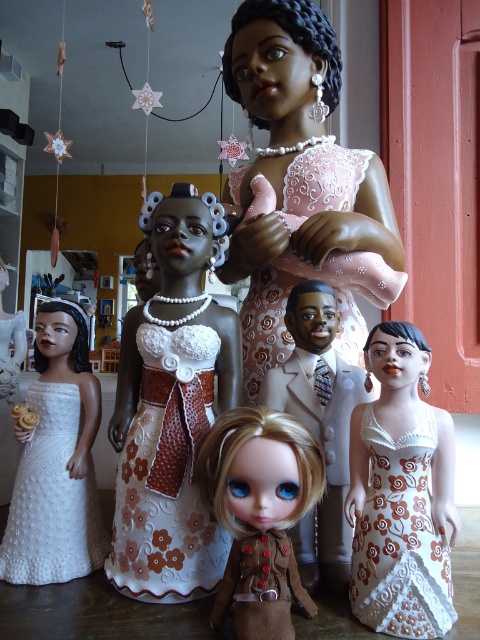
Can you confirm if pink lace dress at center is positioned below white textured dress at center?

No.

Can you confirm if pink lace dress at center is wider than white textured dress at center?

Yes, pink lace dress at center is wider than white textured dress at center.

The height and width of the screenshot is (640, 480). I want to click on pink lace dress at center, so click(x=296, y=172).

Is point (264, 611) positioned after point (31, 394)?

No.

Is point (245, 596) less distant than point (72, 417)?

Yes, it is in front of point (72, 417).

Is point (310, 438) less distant than point (76, 433)?

Yes.

Locate an element on the screen. The height and width of the screenshot is (640, 480). matte brown doll at center is located at coordinates coord(260,513).

Which is below, white textured dress at center or white fabric dress at center?

white fabric dress at center is below.

Which is in front, point (204, 579) or point (357, 576)?

Point (357, 576) is more forward.

Who is more distant from viewer, [168,540] or [368,436]?

Point [168,540]

Where is `white textured dress at center`? This screenshot has width=480, height=640. white textured dress at center is located at coordinates (167, 474).